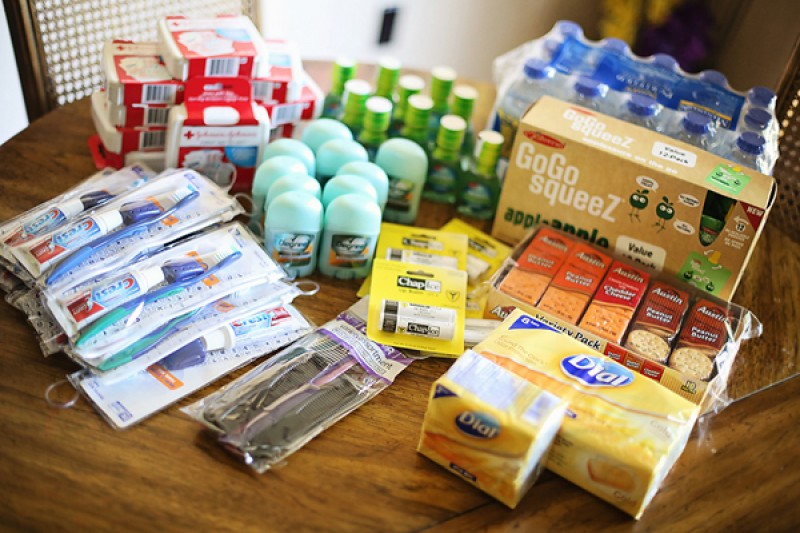
What are the coordinates of `boxes` in the screenshot? It's located at (498, 304), (534, 171), (178, 138), (190, 61), (122, 91), (116, 113), (113, 138), (138, 160), (276, 83), (310, 106).